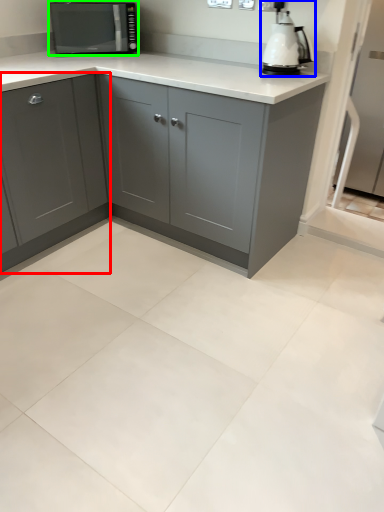
Question: Which is nearer to the cabinetry (highlighted by a red box)? home appliance (highlighted by a blue box) or kitchen appliance (highlighted by a green box).

Choices:
 (A) home appliance
 (B) kitchen appliance

Answer: (B)